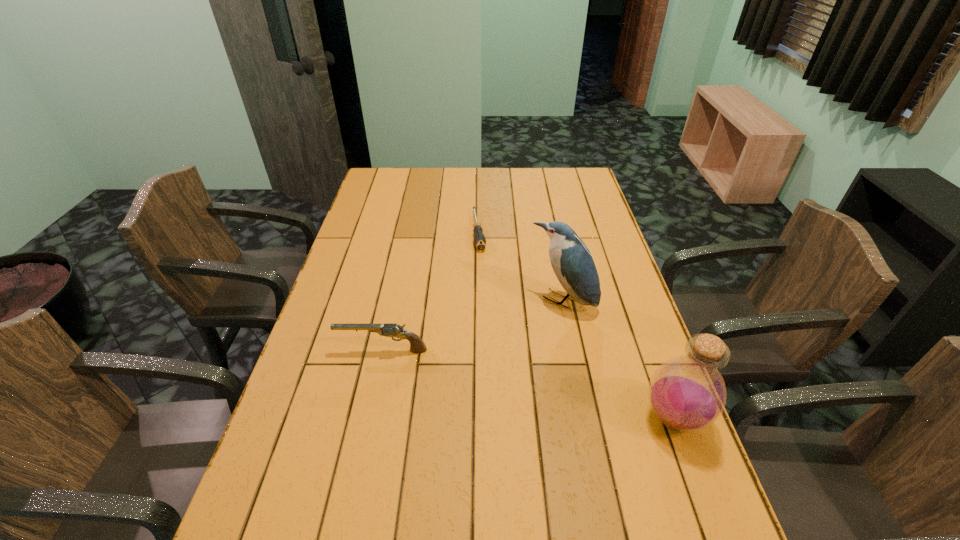
Where is `vacant region at the left edge of the desktop`? This screenshot has height=540, width=960. vacant region at the left edge of the desktop is located at coordinates (299, 466).

In the image, there is a desktop. In order to click on vacant space at the right edge in this screenshot , I will do [612, 243].

In the image, there is a desktop. Identify the location of vacant space at the far right corner. [x=562, y=174].

Locate an element on the screen. free space between the screwdriver and the second farthest object is located at coordinates (520, 266).

Image resolution: width=960 pixels, height=540 pixels. In order to click on unoccupied position between the third farthest object and the second object from right to left in this screenshot , I will do `click(472, 326)`.

The height and width of the screenshot is (540, 960). I want to click on free spot between the second shortest object and the shortest object, so click(431, 291).

This screenshot has height=540, width=960. I want to click on empty location between the third tallest object and the screwdriver, so click(431, 291).

This screenshot has width=960, height=540. I want to click on free area in between the second farthest object and the gun, so click(x=472, y=326).

I want to click on free space that is in between the farthest object and the nearest object, so click(576, 325).

Locate an element on the screen. This screenshot has height=540, width=960. free space between the bird and the nearest object is located at coordinates (618, 360).